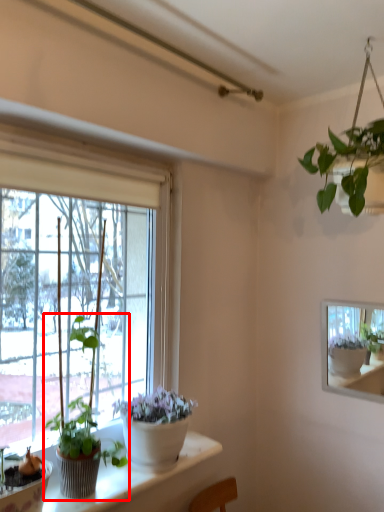
Question: From the image's perspective, where is houseplant (annotated by the red box) located in relation to window in the image?

Choices:
 (A) above
 (B) below

Answer: (B)